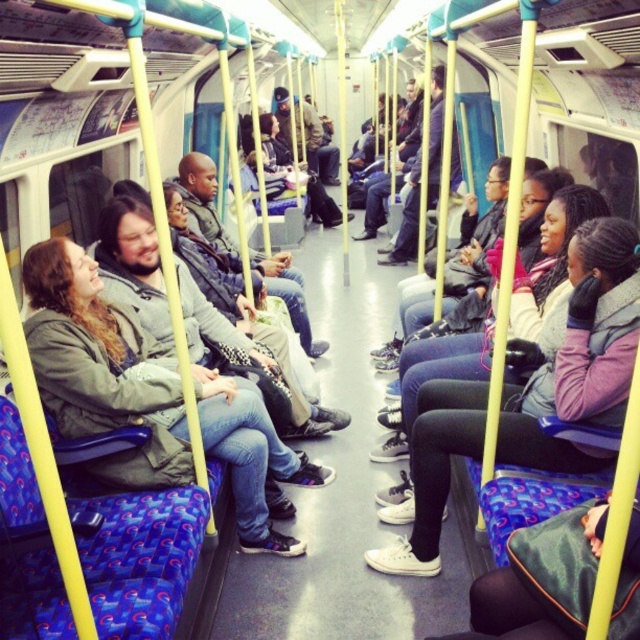
Does green fabric jacket at left have a greater height compared to white matte sneakers at center?

A: No, green fabric jacket at left is not taller than white matte sneakers at center.

Which is below, green fabric jacket at left or white matte sneakers at center?

Positioned lower is green fabric jacket at left.

Who is more forward, (227,458) or (627,298)?

Point (627,298) is more forward.

Identify the location of green fabric jacket at left. (100, 365).